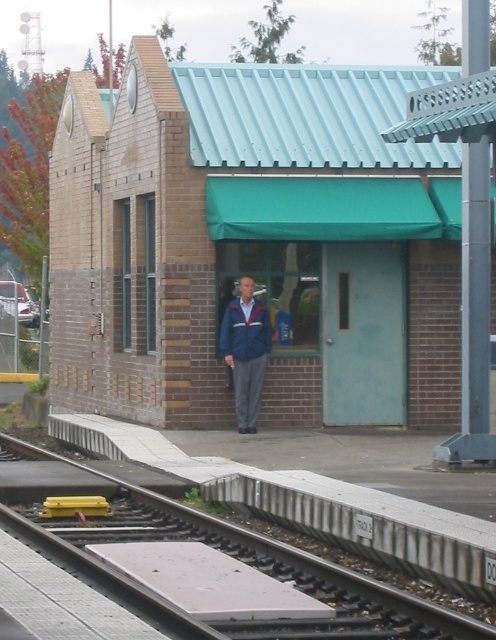
You are a passenger waiting at the station and need to place your luggage on the platform. The luggage must be placed on the metallic gray train track at lower left or the blue fabric jacket at center. Which location is safer for placing your luggage?

The metallic gray train track at lower left is safer for placing your luggage because it has a lesser height compared to the blue fabric jacket at center, reducing the risk of the luggage falling off.

You are a passenger standing on the platform and want to walk to the brown brick building at center from the metallic gray train track at lower left. Which direction should you move relative to the tracks?

Since the brown brick building at center has a lesser width compared to the metallic gray train track at lower left, you should move towards the narrower side of the tracks to reach the building.

You are standing at the entrance of the brown brick building at center. If you walk straight ahead, will you be facing the railway tracks or the platform?

The brown brick building at center is located at point (253, 243), so walking straight ahead from the entrance would face the railway tracks and platform area. However, based on the scene description, the platform extends alongside the tracks in front of the building. Since the building is at the center, walking straight ahead likely faces the platform adjacent to the tracks. The answer depends on the exact positioning, but according to the coordinates, the building is positioned such that the entrance is